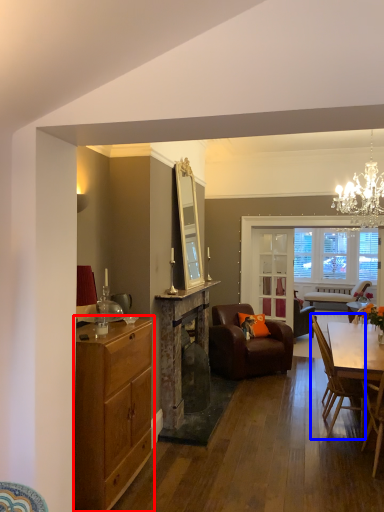
Question: Among these objects, which one is farthest to the camera, cabinetry (highlighted by a red box) or chair (highlighted by a blue box)?

Choices:
 (A) cabinetry
 (B) chair

Answer: (B)